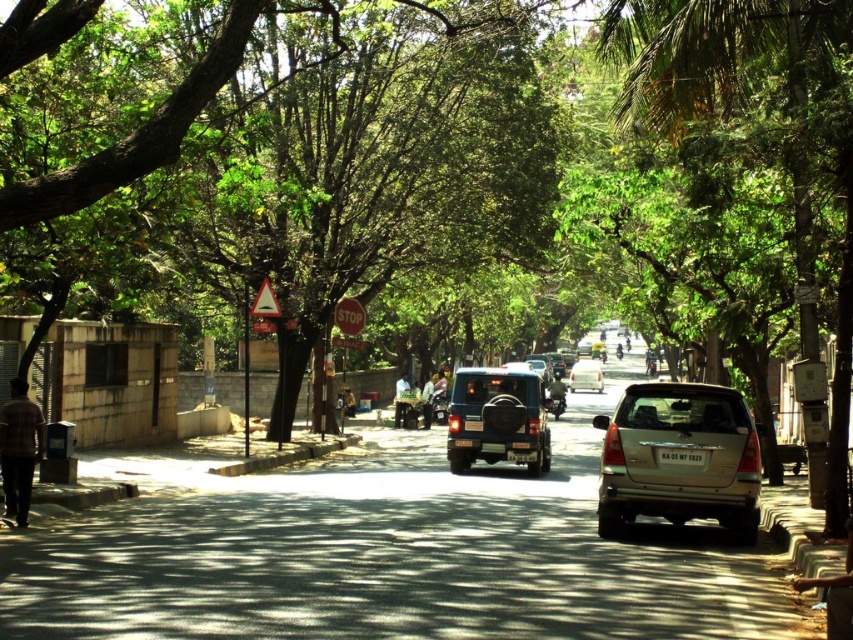
Question: Does gold metallic suv at center come behind silver metallic suv at center?

Choices:
 (A) no
 (B) yes

Answer: (A)

Question: Which object is farther from the camera taking this photo?

Choices:
 (A) gold metallic suv at center
 (B) silver metallic suv at center
 (C) matte black suv at center

Answer: (B)

Question: Which of the following is the farthest from the observer?

Choices:
 (A) (469, 445)
 (B) (509, 104)
 (C) (595, 378)
 (D) (640, 432)

Answer: (C)

Question: Which object appears farthest from the camera in this image?

Choices:
 (A) green leafy tree at center
 (B) gold metallic suv at center
 (C) silver metallic suv at center
 (D) matte black suv at center

Answer: (C)

Question: Is green leafy tree at center thinner than gold metallic suv at center?

Choices:
 (A) yes
 (B) no

Answer: (B)

Question: Can you confirm if gold metallic suv at center is positioned to the right of matte black suv at center?

Choices:
 (A) no
 (B) yes

Answer: (B)